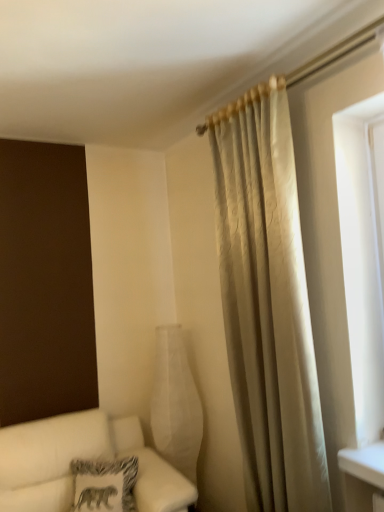
Question: Is white matte glass vase at center inside the boundaries of white fabric couch at lower left, or outside?

Choices:
 (A) inside
 (B) outside

Answer: (B)

Question: Is white matte glass vase at center taller or shorter than white fabric couch at lower left?

Choices:
 (A) tall
 (B) short

Answer: (A)

Question: Estimate the real-world distances between objects in this image. Which object is closer to the white matte glass vase at center?

Choices:
 (A) patterned fabric pillow at lower left
 (B) white fabric couch at lower left
 (C) silky beige curtain at right

Answer: (B)

Question: Estimate the real-world distances between objects in this image. Which object is closer to the silky beige curtain at right?

Choices:
 (A) white matte glass vase at center
 (B) patterned fabric pillow at lower left
 (C) white fabric couch at lower left

Answer: (A)